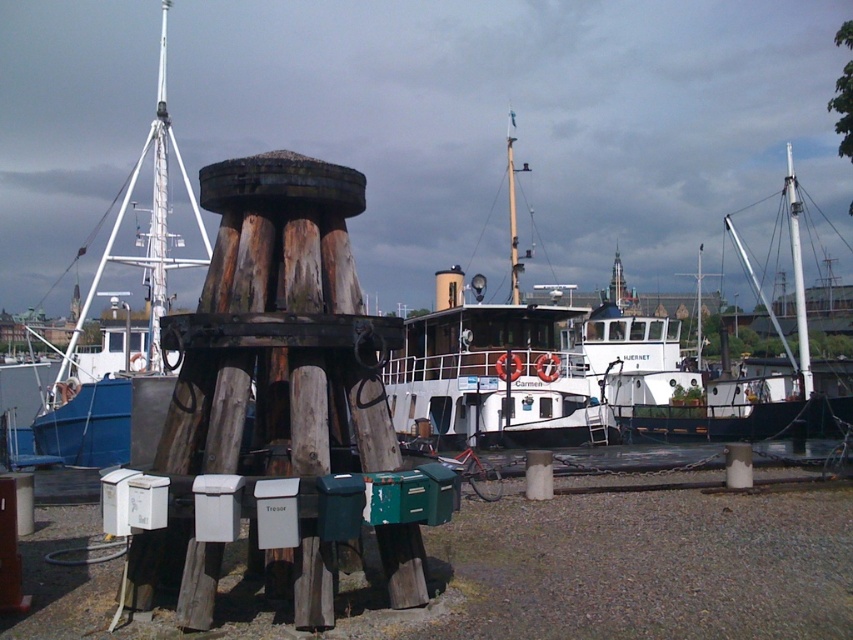
Question: Which of these objects is positioned closest to the blue painted wood boat at left?

Choices:
 (A) white matte boat at center
 (B) white wooden boat at center

Answer: (A)

Question: Does white matte boat at center appear on the left side of blue painted wood boat at left?

Choices:
 (A) no
 (B) yes

Answer: (A)

Question: Can you confirm if white matte boat at center is smaller than blue painted wood boat at left?

Choices:
 (A) no
 (B) yes

Answer: (B)

Question: Does blue painted wood boat at left appear under white wooden boat at center?

Choices:
 (A) yes
 (B) no

Answer: (B)

Question: Which point appears farthest from the camera in this image?

Choices:
 (A) (160, 42)
 (B) (601, 429)

Answer: (A)

Question: Which object is positioned farthest from the white matte boat at center?

Choices:
 (A) white wooden boat at center
 (B) blue painted wood boat at left

Answer: (B)